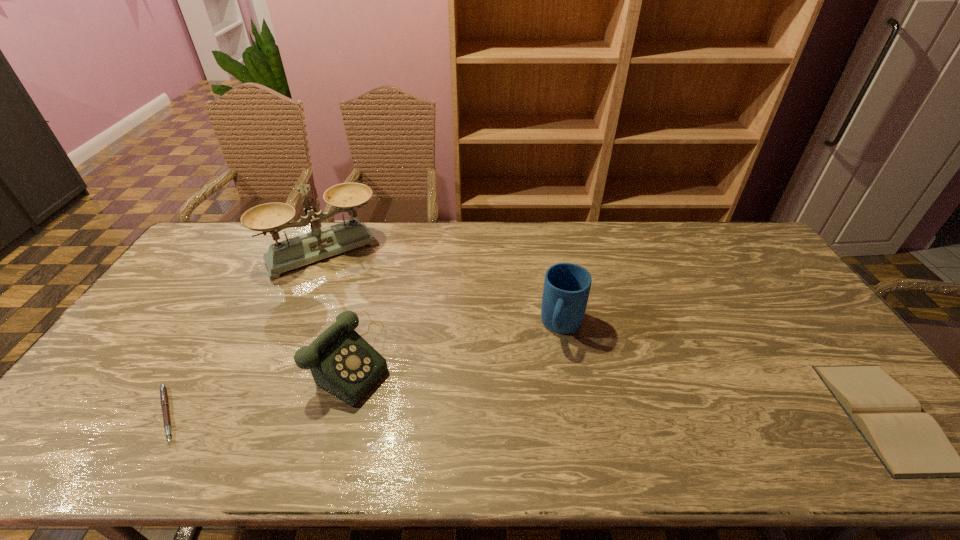
What are the coordinates of `free region located 0.090m on the dial of the third shortest object` in the screenshot? It's located at (409, 398).

Where is `free spot located 0.390m on the front-facing side of the tallest object`? Image resolution: width=960 pixels, height=540 pixels. free spot located 0.390m on the front-facing side of the tallest object is located at coordinates (390, 354).

Image resolution: width=960 pixels, height=540 pixels. I want to click on free space located on the front-facing side of the tallest object, so click(x=371, y=322).

The height and width of the screenshot is (540, 960). Find the location of `free space located on the front-facing side of the tallest object`. free space located on the front-facing side of the tallest object is located at coordinates (370, 320).

Locate an element on the screen. object situated at the far edge is located at coordinates (318, 244).

Where is `pen situated at the near edge`? pen situated at the near edge is located at coordinates (163, 390).

Locate an element on the screen. The width and height of the screenshot is (960, 540). telephone present at the near edge is located at coordinates (342, 363).

Locate an element on the screen. vacant space at the far edge of the desktop is located at coordinates (344, 254).

Locate an element on the screen. The width and height of the screenshot is (960, 540). vacant space at the near edge of the desktop is located at coordinates (478, 398).

This screenshot has width=960, height=540. What are the coordinates of `blank space at the left edge of the desktop` in the screenshot? It's located at (148, 326).